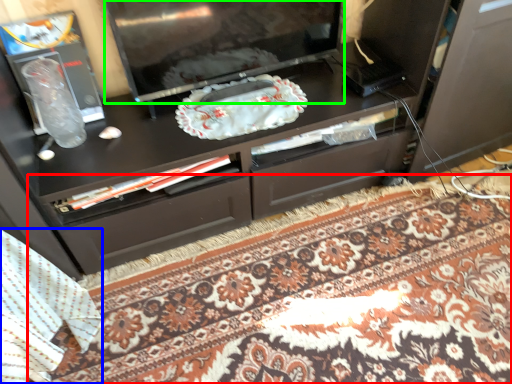
Question: Based on their relative distances, which object is nearer to mat (highlighted by a red box)? Choose from blanket (highlighted by a blue box) and television (highlighted by a green box).

Choices:
 (A) blanket
 (B) television

Answer: (A)